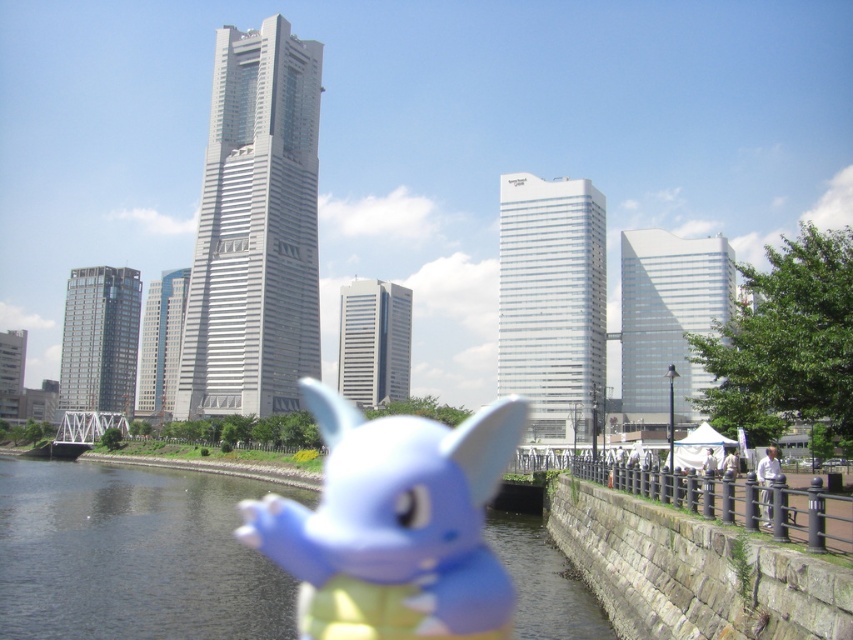
Question: Is smooth dark water at center behind matte blue plush toy at center?

Choices:
 (A) no
 (B) yes

Answer: (A)

Question: Can you confirm if smooth dark water at center is positioned to the right of matte blue plush toy at center?

Choices:
 (A) yes
 (B) no

Answer: (B)

Question: Which object is farther from the camera taking this photo?

Choices:
 (A) smooth dark water at center
 (B) matte blue plush toy at center

Answer: (B)

Question: Where is smooth dark water at center located in relation to matte blue plush toy at center in the image?

Choices:
 (A) above
 (B) below

Answer: (B)

Question: Which of the following is the closest to the observer?

Choices:
 (A) matte blue plush toy at center
 (B) smooth dark water at center

Answer: (B)

Question: Among these objects, which one is farthest from the camera?

Choices:
 (A) smooth dark water at center
 (B) matte blue plush toy at center

Answer: (B)